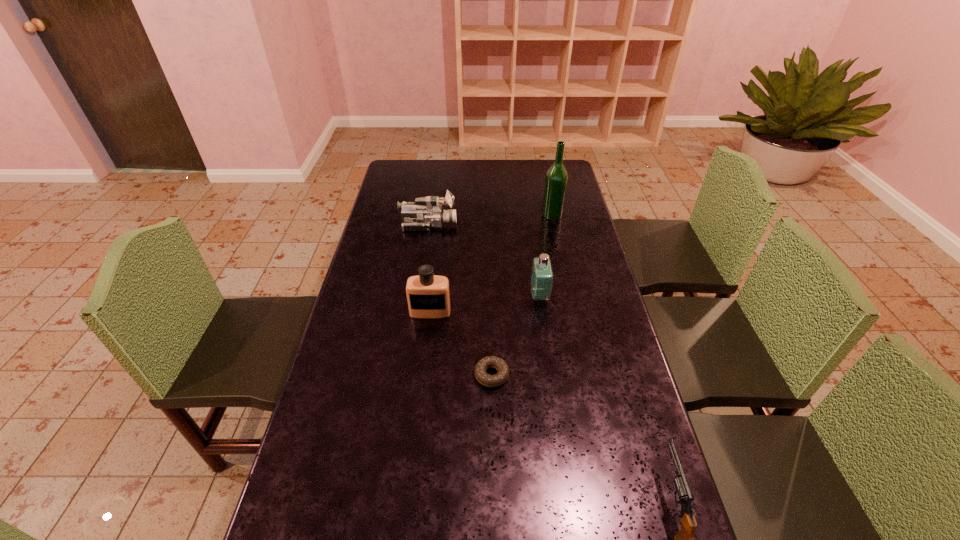
Find the location of `free area in between the alcohol and the third object from left to right`. free area in between the alcohol and the third object from left to right is located at coordinates (522, 295).

Find the location of `empty location between the camcorder and the tallest object`. empty location between the camcorder and the tallest object is located at coordinates (491, 220).

Identify the location of vacant space that's between the alcohol and the third object from left to right. The height and width of the screenshot is (540, 960). (522, 295).

You are a GUI agent. You are given a task and a screenshot of the screen. Output one action in this format:
    pyautogui.click(x=<x>, y=<y>)
    Task: Click on the free space that is in between the left perfume and the fourth object from left to right
    The image size is (960, 540).
    Given the screenshot: What is the action you would take?
    (485, 303)

The height and width of the screenshot is (540, 960). In order to click on vacant area that lies between the camcorder and the doughnut in this screenshot , I will do click(460, 300).

Point out which object is positioned as the second nearest to the left perfume. Please provide its 2D coordinates. Your answer should be formatted as a tuple, i.e. [(x, y)], where the tuple contains the x and y coordinates of a point satisfying the conditions above.

[(542, 274)]

You are a GUI agent. You are given a task and a screenshot of the screen. Output one action in this format:
    pyautogui.click(x=<x>, y=<y>)
    Task: Click on the object that can be found as the fifth closest to the alcohol
    
    Given the screenshot: What is the action you would take?
    pyautogui.click(x=684, y=539)

Find the location of a particular element. The height and width of the screenshot is (540, 960). vacant position in the image that satisfies the following two spatial constraints: 1. on the front-facing side of the camcorder; 2. on the right side of the shortest object is located at coordinates (406, 375).

The height and width of the screenshot is (540, 960). Identify the location of vacant region that satisfies the following two spatial constraints: 1. on the front-facing side of the camcorder; 2. on the right side of the shortest object. (406, 375).

The height and width of the screenshot is (540, 960). I want to click on vacant area that satisfies the following two spatial constraints: 1. on the front label of the left perfume; 2. on the right side of the shortest object, so click(x=422, y=375).